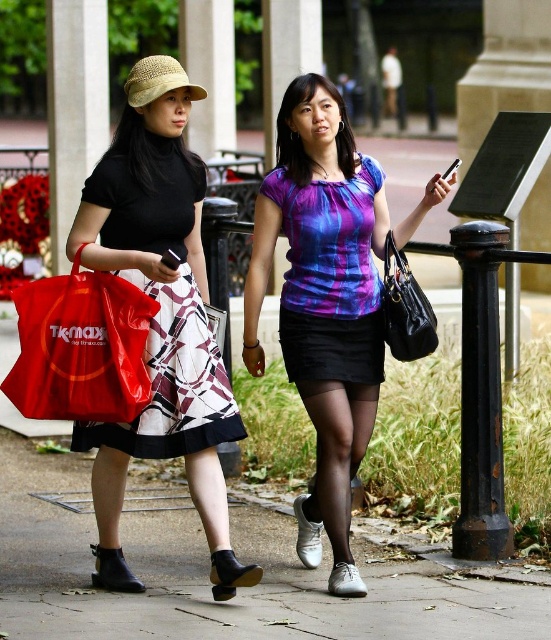
Question: Where is black leather handbag at right located in relation to straw hat at upper left in the image?

Choices:
 (A) above
 (B) below

Answer: (B)

Question: Is the position of purple tie-dye blouse at center less distant than that of red plastic bag at left?

Choices:
 (A) yes
 (B) no

Answer: (B)

Question: Which point is closer to the camera?

Choices:
 (A) red plastic bag at left
 (B) concrete sidewalk at center
 (C) black leather handbag at right
 (D) shiny purple fabric dress at center

Answer: (B)

Question: Is shiny purple fabric dress at center bigger than straw hat at upper left?

Choices:
 (A) no
 (B) yes

Answer: (B)

Question: Which object is the farthest from the black leather handbag at right?

Choices:
 (A) straw hat at upper left
 (B) white and black patterned skirt at left
 (C) concrete sidewalk at center
 (D) purple tie-dye blouse at center

Answer: (A)

Question: Which object is positioned farthest from the straw hat at upper left?

Choices:
 (A) purple tie-dye blouse at center
 (B) white and black patterned skirt at left
 (C) concrete sidewalk at center
 (D) shiny purple fabric dress at center

Answer: (C)